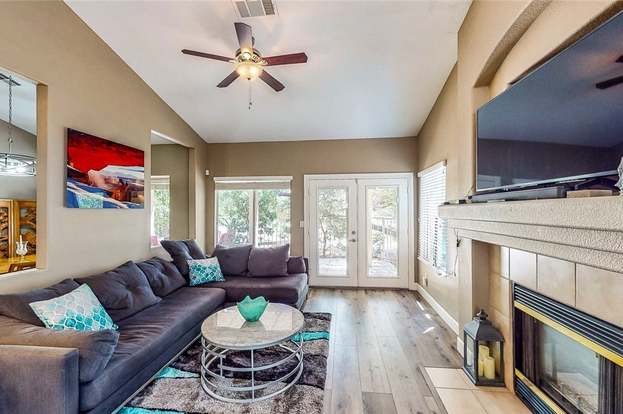
The width and height of the screenshot is (623, 414). I want to click on fireplace, so click(x=528, y=320).